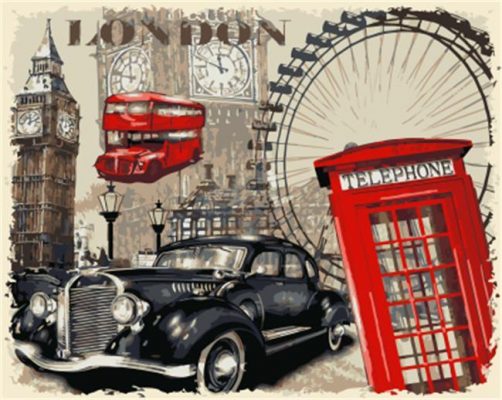
Image resolution: width=502 pixels, height=400 pixels. In order to click on lamp in this screenshot , I will do `click(107, 203)`.